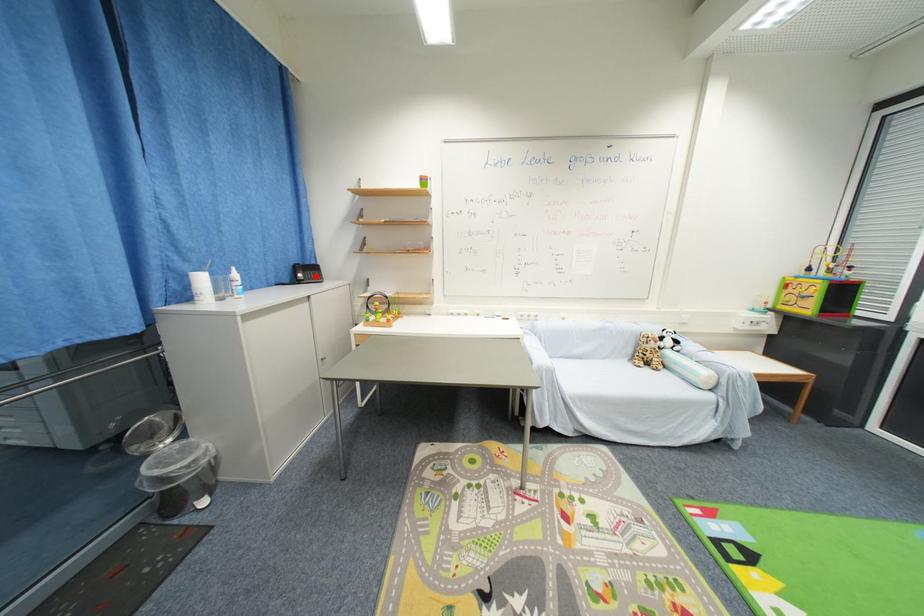
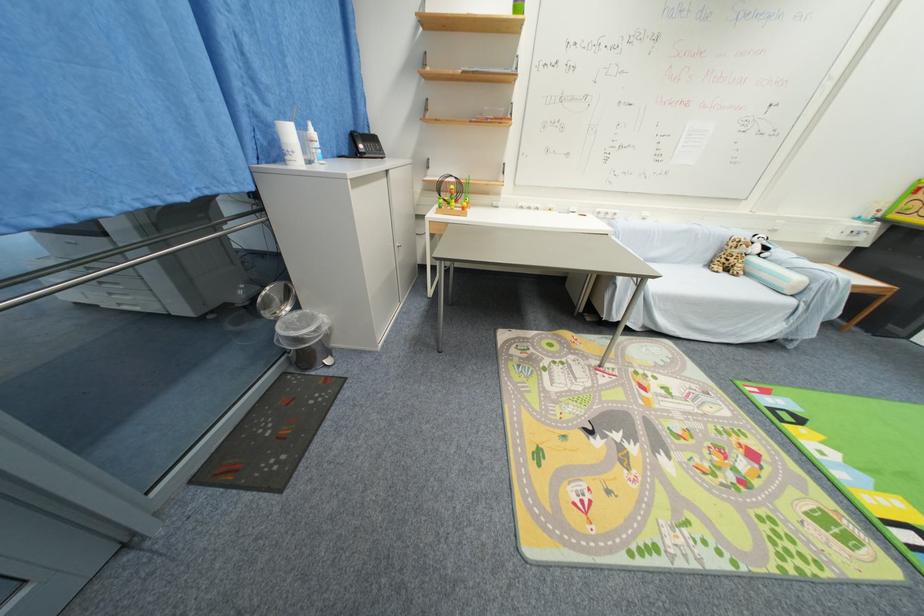
Question: I am providing you with two images of the same scene from different viewpoints. A red point is marked on the first image. At the location where the point appears in image 1, is it still visible in image 2?

Choices:
 (A) Yes
 (B) No

Answer: (A)